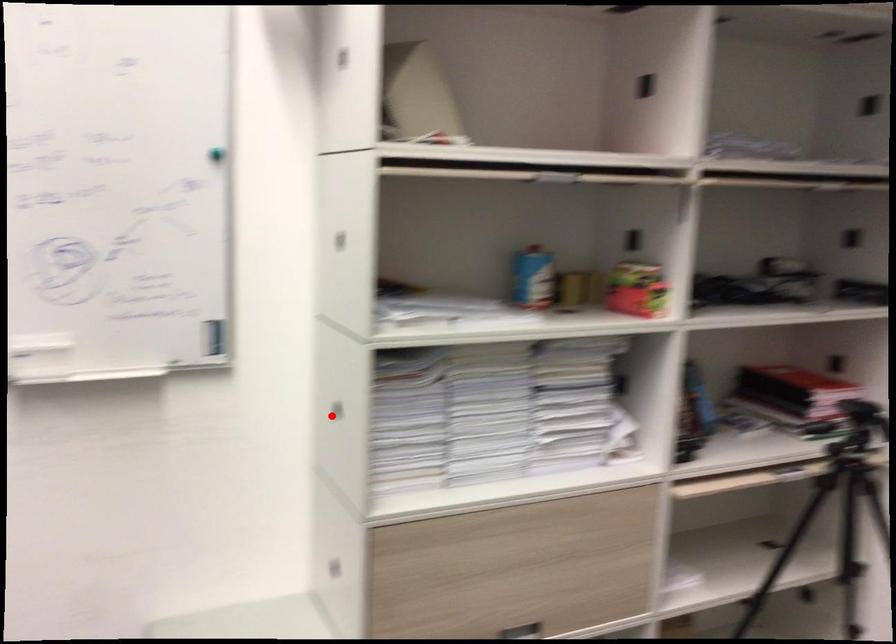
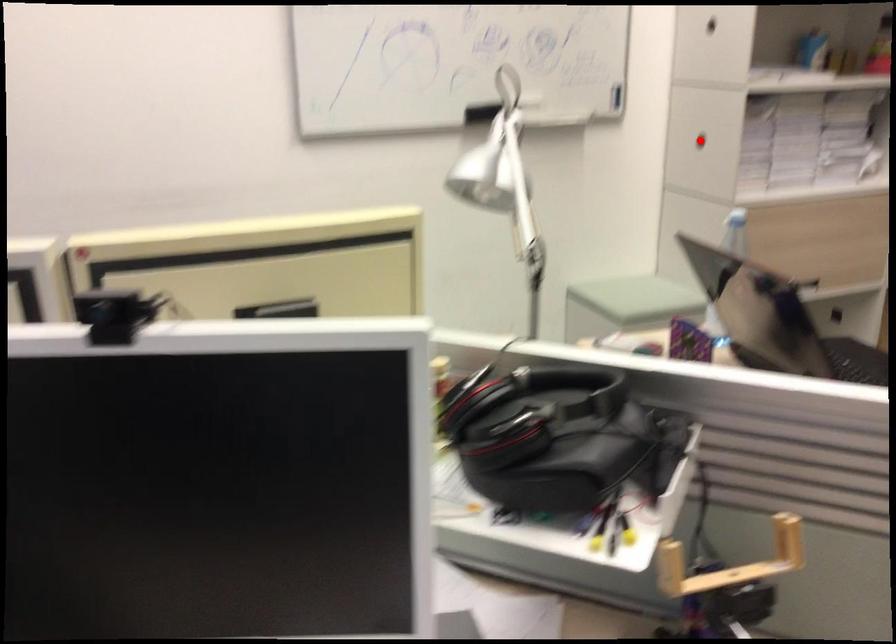
I am providing you with two images of the same scene from different viewpoints. A red point is marked on the first image and another point is marked on the second image. Does the point marked in image1 correspond to the same location as the one in image2?

Yes